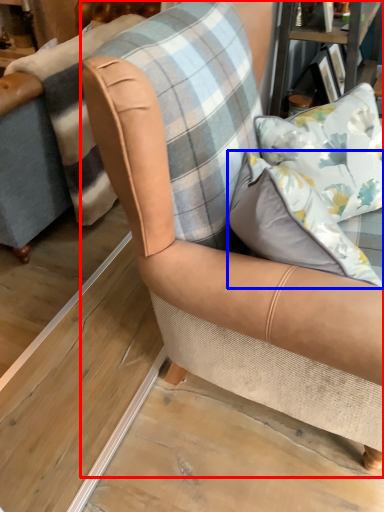
Question: Which of the following is the closest to the observer, chair (highlighted by a red box) or pillow (highlighted by a blue box)?

Choices:
 (A) chair
 (B) pillow

Answer: (B)